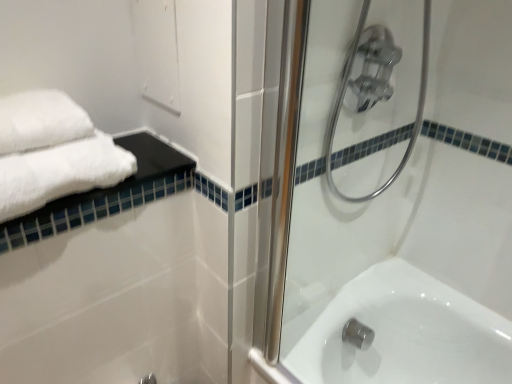
Question: Based on their sizes in the image, would you say white soft towel at upper left is bigger or smaller than clear glass shower door at upper center?

Choices:
 (A) small
 (B) big

Answer: (A)

Question: Is white soft towel at upper left in front of or behind clear glass shower door at upper center in the image?

Choices:
 (A) front
 (B) behind

Answer: (B)

Question: Considering the positions of white soft towel at upper left and clear glass shower door at upper center in the image, is white soft towel at upper left taller or shorter than clear glass shower door at upper center?

Choices:
 (A) tall
 (B) short

Answer: (B)

Question: Is point (284, 380) positioned closer to the camera than point (33, 193)?

Choices:
 (A) closer
 (B) farther

Answer: (B)

Question: In terms of size, does clear glass shower door at upper center appear bigger or smaller than white soft towel at upper left?

Choices:
 (A) big
 (B) small

Answer: (A)

Question: Is clear glass shower door at upper center taller or shorter than white soft towel at upper left?

Choices:
 (A) tall
 (B) short

Answer: (A)

Question: From a real-world perspective, relative to white soft towel at upper left, is clear glass shower door at upper center vertically above or below?

Choices:
 (A) below
 (B) above

Answer: (A)